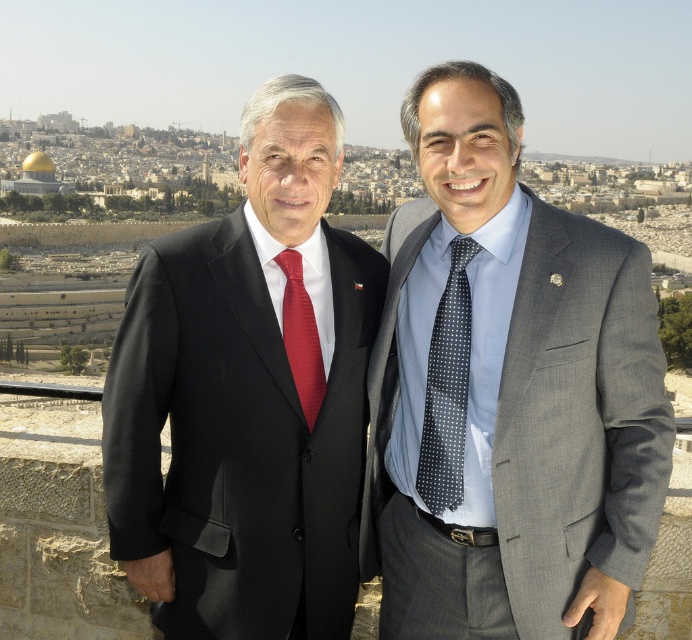
Question: Which object appears farthest from the camera in this image?

Choices:
 (A) dark blue dotted tie at center
 (B) gray textured suit at right
 (C) black matte suit at center

Answer: (A)

Question: Which point appears farthest from the camera in this image?

Choices:
 (A) (242, 257)
 (B) (556, 548)
 (C) (289, 358)

Answer: (A)

Question: Which point appears closest to the camera in this image?

Choices:
 (A) (457, 410)
 (B) (215, 515)
 (C) (619, 410)
 (D) (300, 317)

Answer: (C)

Question: Does black matte suit at center have a lesser width compared to matte red tie at center?

Choices:
 (A) no
 (B) yes

Answer: (A)

Question: Is black matte suit at center closer to the viewer compared to dark blue dotted tie at center?

Choices:
 (A) yes
 (B) no

Answer: (A)

Question: Can you confirm if black matte suit at center is wider than matte red tie at center?

Choices:
 (A) yes
 (B) no

Answer: (A)